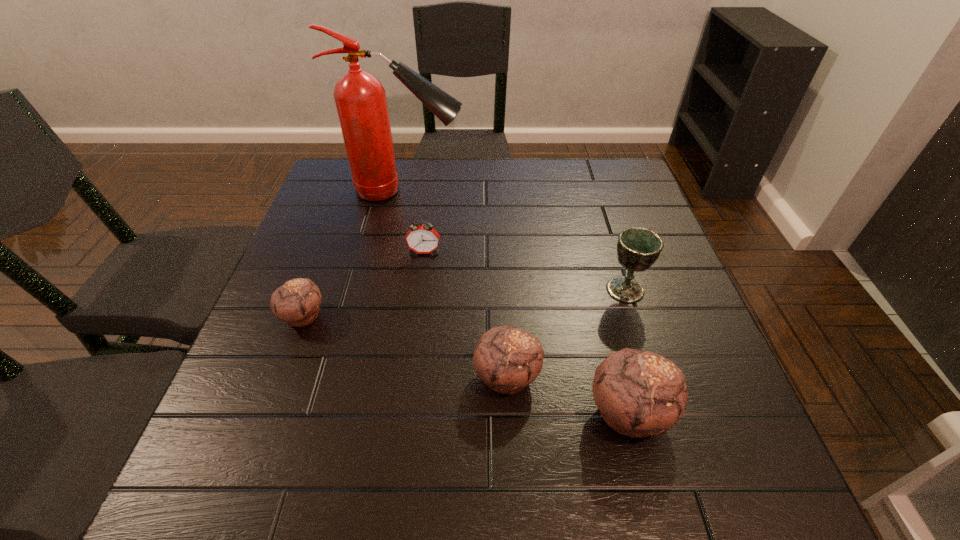
This screenshot has height=540, width=960. Identify the location of object that is positioned at the far left corner. (360, 99).

At what (x,y) coordinates should I click in order to perform the action: click on object present at the near right corner. Please return your answer as a coordinate pair (x, y). The width and height of the screenshot is (960, 540). Looking at the image, I should click on (639, 393).

I want to click on free space at the far edge, so click(459, 164).

In the image, there is a desktop. Where is `vacant space at the left edge`? Image resolution: width=960 pixels, height=540 pixels. vacant space at the left edge is located at coordinates (335, 300).

Locate an element on the screen. This screenshot has width=960, height=540. free space at the right edge of the desktop is located at coordinates (607, 231).

The height and width of the screenshot is (540, 960). In order to click on vacant region at the far left corner in this screenshot , I will do `click(332, 190)`.

Locate an element on the screen. The image size is (960, 540). free location at the far right corner of the desktop is located at coordinates (619, 196).

This screenshot has width=960, height=540. In order to click on vacant area that lies between the tallest object and the shortest muffin in this screenshot , I will do `click(354, 253)`.

This screenshot has height=540, width=960. In order to click on free area in between the alarm clock and the shortest muffin in this screenshot , I will do [364, 284].

What are the coordinates of `vacant space that's between the tallest object and the chalice` in the screenshot? It's located at (516, 240).